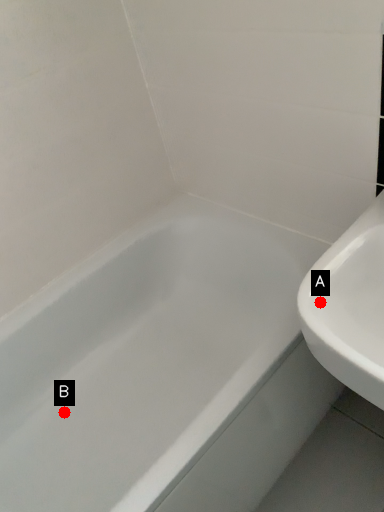
Question: Two points are circled on the image, labeled by A and B beside each circle. Which point is further to the camera?

Choices:
 (A) A is further
 (B) B is further

Answer: (B)